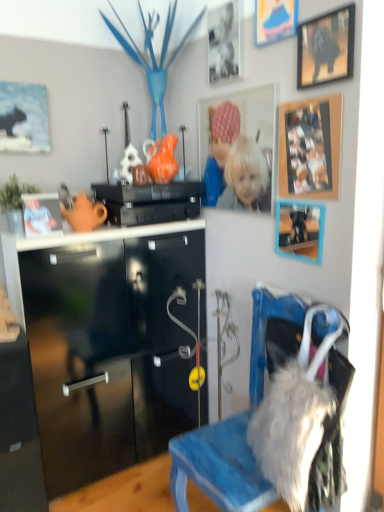
Question: Considering their positions, is black matte picture frame at upper center, the 5th picture frame positioned from the right, located in front of or behind matte orange teapot at upper left, which is counted as the second toy, starting from the back?

Choices:
 (A) behind
 (B) front

Answer: (B)

Question: In terms of height, does black matte picture frame at upper center, which is the 2th picture frame in left-to-right order, look taller or shorter compared to matte orange teapot at upper left, which appears as the 1th toy when viewed from the front?

Choices:
 (A) tall
 (B) short

Answer: (A)

Question: Which object is positioned farthest from the wooden photo frame at upper right, arranged as the 2th picture frame when viewed from the right?

Choices:
 (A) orange glossy vase at center, the 1th toy from the back
 (B) wooden photo frame at upper center, placed as the 3th picture frame when sorted from left to right
 (C) smooth plastic toy at upper left
 (D) matte orange teapot at upper left, which appears as the 1th toy when viewed from the front
 (E) black matte picture frame at upper center, the 5th picture frame positioned from the right

Answer: (C)

Question: Which is farther from the orange glossy vase at center, the 1th toy from the back?

Choices:
 (A) wooden picture frame at upper right, which ranks as the 3th picture frame in right-to-left order
 (B) wooden photo frame at upper center, placed as the 3th picture frame when sorted from left to right
 (C) black plastic speaker at center
 (D) smooth plastic toy at upper left
 (E) black glossy cabinet at lower left

Answer: (E)